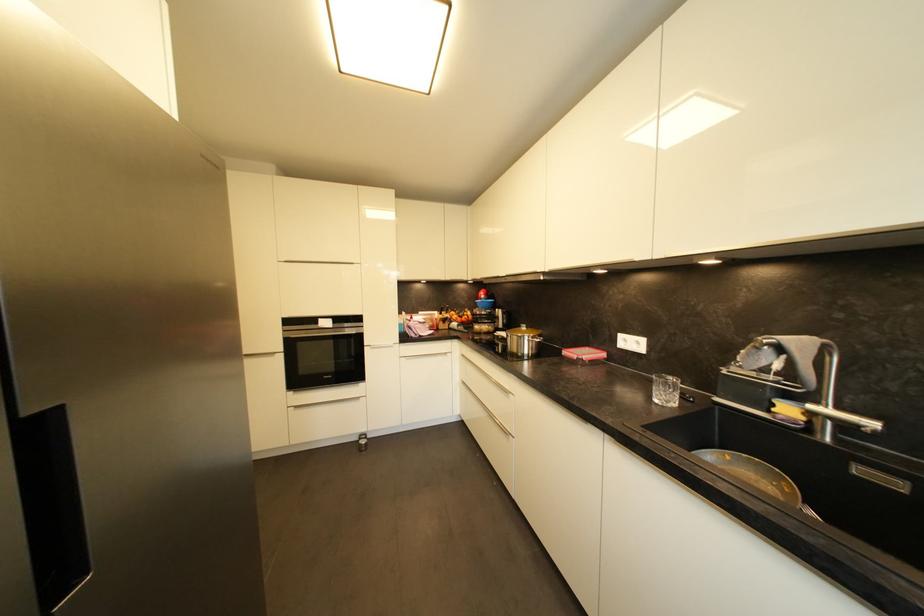
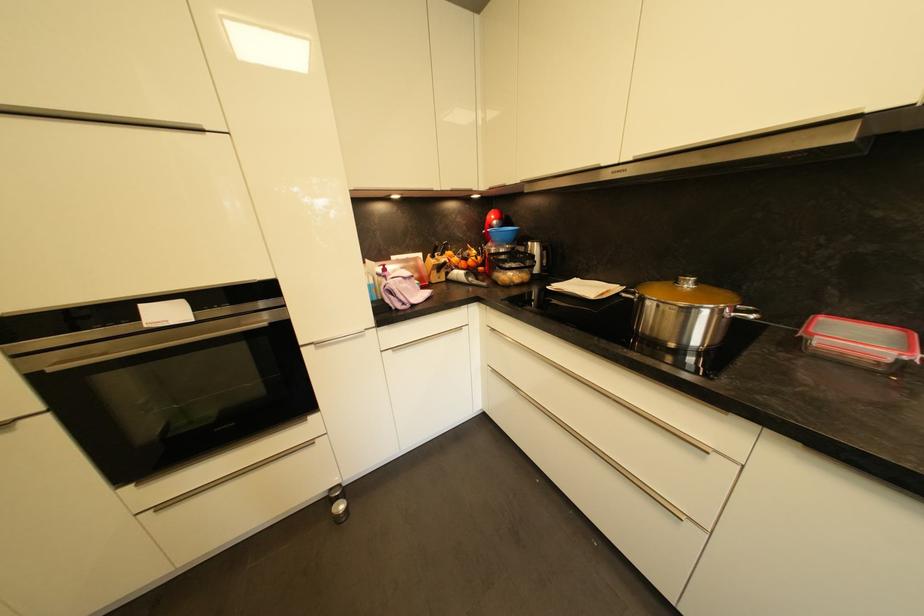
The point at (469, 331) is marked in the first image. Where is the corresponding point in the second image?

(481, 281)